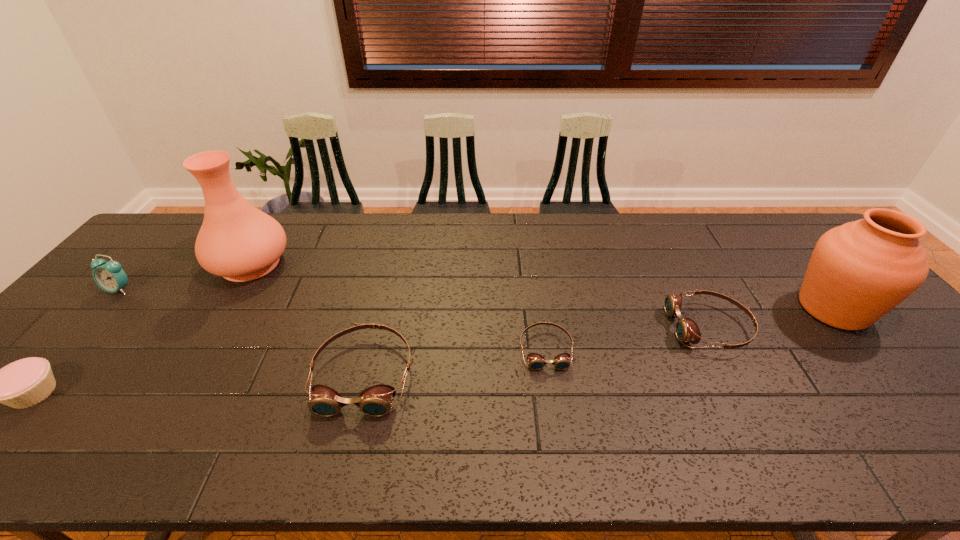
Find the location of a particular element. The image size is (960, 540). vacant point located 0.090m through the lenses of the fifth object from left to right is located at coordinates (554, 404).

Where is `vacant space located 0.160m through the lenses of the rightmost goggles`? This screenshot has width=960, height=540. vacant space located 0.160m through the lenses of the rightmost goggles is located at coordinates (610, 327).

The width and height of the screenshot is (960, 540). I want to click on vacant point located 0.090m through the lenses of the rightmost goggles, so click(636, 327).

I want to click on free region located through the lenses of the rightmost goggles, so click(x=549, y=327).

I want to click on vacant region located 0.090m on the right of the fifth object from right to left, so click(x=320, y=264).

Locate an element on the screen. Image resolution: width=960 pixels, height=540 pixels. free region located on the face of the alarm clock is located at coordinates (93, 320).

Identify the location of free point located on the left of the second tallest object. (763, 309).

This screenshot has height=540, width=960. Find the location of `object located at the far edge`. object located at the far edge is located at coordinates (236, 241).

Locate an element on the screen. object at the near edge is located at coordinates click(x=375, y=401).

Where is `object present at the left edge`? Image resolution: width=960 pixels, height=540 pixels. object present at the left edge is located at coordinates (110, 276).